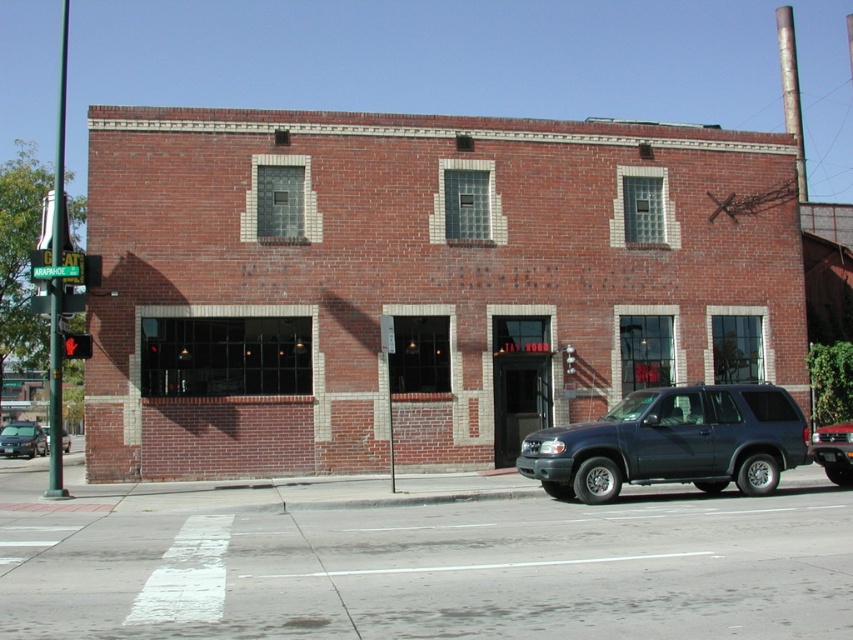
You are standing at the intersection and want to determine the relative positions of two points marked on the building facade. Which point is closer to you, point 1 at coordinates (1, 429) or point 2 at coordinates (86, 340)?

Point 1 at coordinates (1, 429) is closer to you because it is further to the viewer than point 2 at coordinates (86, 340).

Consider the image. You are standing at the intersection and want to walk from the point at coordinates point (193, 154) to the point at coordinates point (708, 404). Which direction should you move in relation to the building?

You should move towards the building because point (193, 154) is behind point (708, 404) relative to the building.